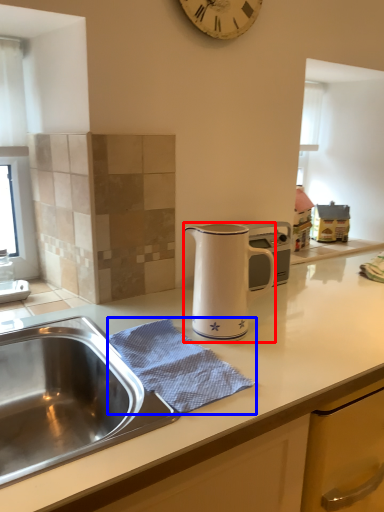
Question: Which object appears farthest to the camera in this image, jug (highlighted by a red box) or blanket (highlighted by a blue box)?

Choices:
 (A) jug
 (B) blanket

Answer: (A)